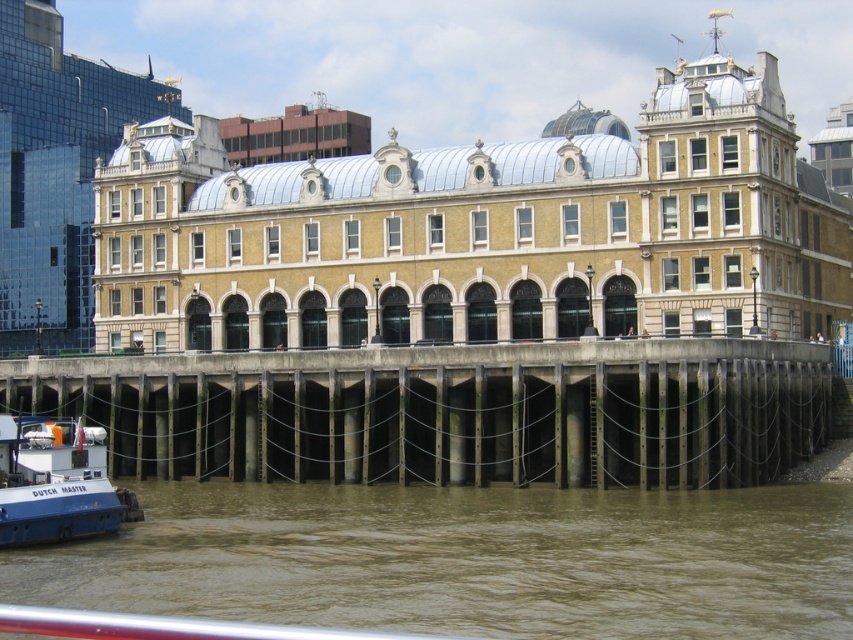
Does concrete dock at lower center have a greater height compared to blue matte boat at lower left?

Yes, concrete dock at lower center is taller than blue matte boat at lower left.

Can you confirm if concrete dock at lower center is positioned to the left of blue matte boat at lower left?

In fact, concrete dock at lower center is to the right of blue matte boat at lower left.

Image resolution: width=853 pixels, height=640 pixels. What are the coordinates of `concrete dock at lower center` in the screenshot? It's located at (450, 412).

Find the location of `concrete dock at lower center`. concrete dock at lower center is located at coordinates 450,412.

Is brown muddy water at lower center shorter than concrete dock at lower center?

Indeed, brown muddy water at lower center has a lesser height compared to concrete dock at lower center.

Who is shorter, brown muddy water at lower center or concrete dock at lower center?

brown muddy water at lower center

Who is more forward, (x=711, y=538) or (x=503, y=403)?

Point (x=711, y=538) is more forward.

Locate an element on the screen. The image size is (853, 640). brown muddy water at lower center is located at coordinates (467, 560).

Does brown muddy water at lower center have a greater width compared to blue matte boat at lower left?

Indeed, brown muddy water at lower center has a greater width compared to blue matte boat at lower left.

Does point (665, 586) lie in front of point (62, 509)?

That is True.

Does point (837, 497) come closer to viewer compared to point (1, 481)?

No, (837, 497) is behind (1, 481).

Find the location of a particular element. This screenshot has width=853, height=640. brown muddy water at lower center is located at coordinates (467, 560).